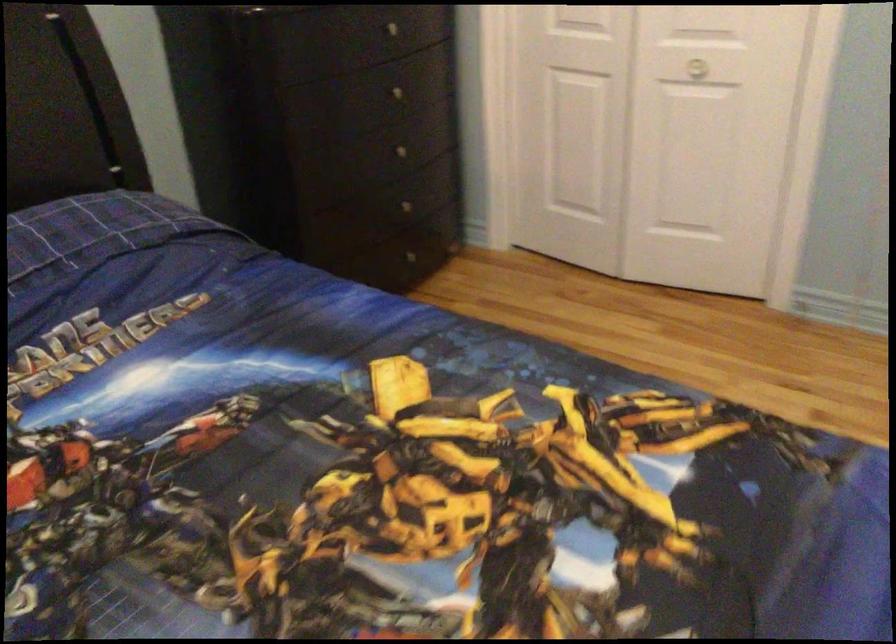
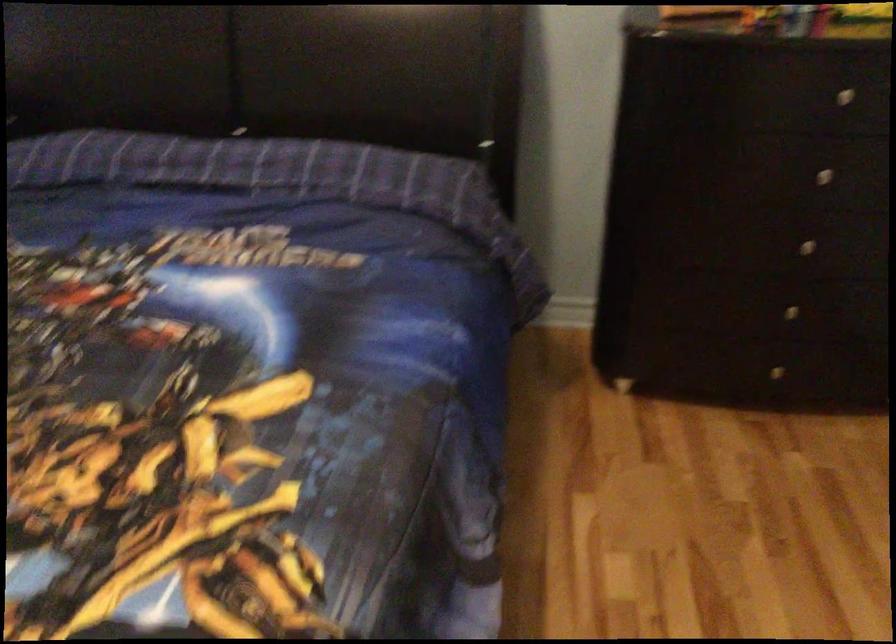
In the second image, find the point that corresponds to (x=406, y=149) in the first image.

(805, 245)